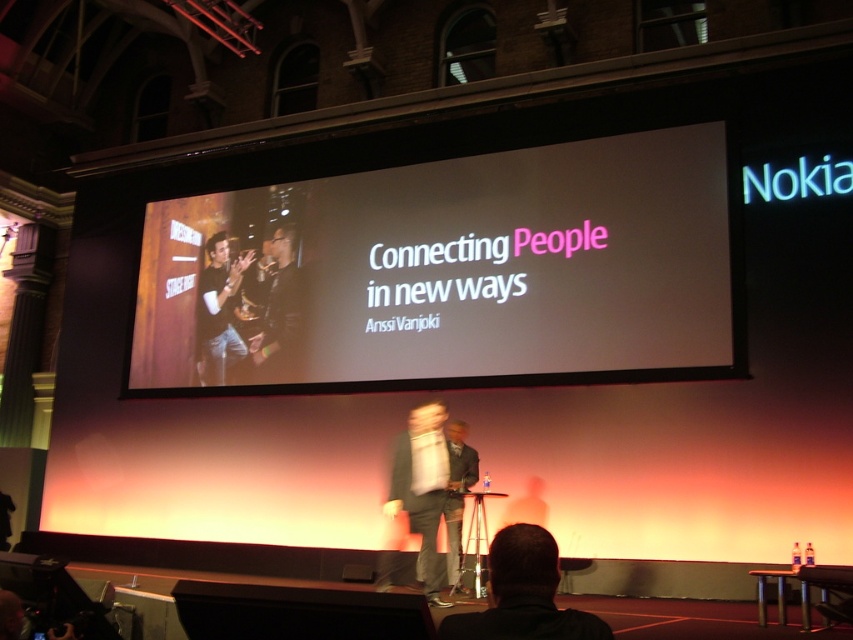
Is black fabric at lower center positioned in front of matte black suit at center?

Yes, it is in front of matte black suit at center.

Is black fabric at lower center above matte black suit at center?

Yes.

Between point (511, 560) and point (363, 580), which one is positioned in front?

Point (511, 560) is more forward.

You are a GUI agent. You are given a task and a screenshot of the screen. Output one action in this format:
    pyautogui.click(x=<x>, y=<y>)
    Task: Click on the black fabric at lower center
    The height and width of the screenshot is (640, 853).
    Given the screenshot: What is the action you would take?
    pyautogui.click(x=523, y=595)

Is black matte jacket at center above matte black suit at center?

Correct, black matte jacket at center is located above matte black suit at center.

Can you confirm if black matte jacket at center is wider than matte black suit at center?

In fact, black matte jacket at center might be narrower than matte black suit at center.

Does point (296, 237) come in front of point (368, 577)?

No.

The image size is (853, 640). I want to click on black matte jacket at center, so click(x=279, y=310).

Is point (247, 188) closer to camera compared to point (412, 509)?

No, (247, 188) is further to viewer.

Is white glossy projection screen at center positioned behind light gray suit at center?

Yes, white glossy projection screen at center is behind light gray suit at center.

Is point (572, 346) closer to camera compared to point (437, 500)?

No, it is behind (437, 500).

This screenshot has width=853, height=640. I want to click on white glossy projection screen at center, so click(x=450, y=273).